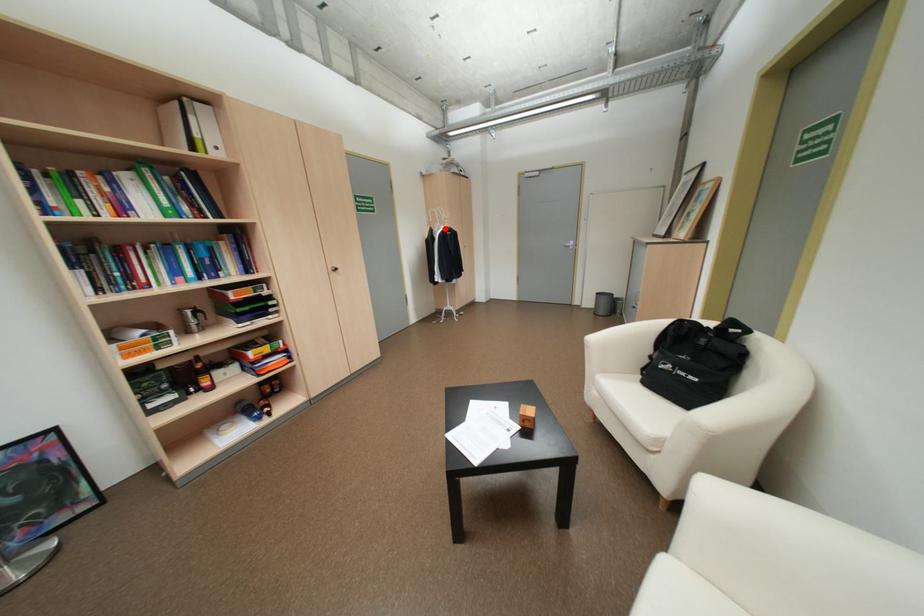
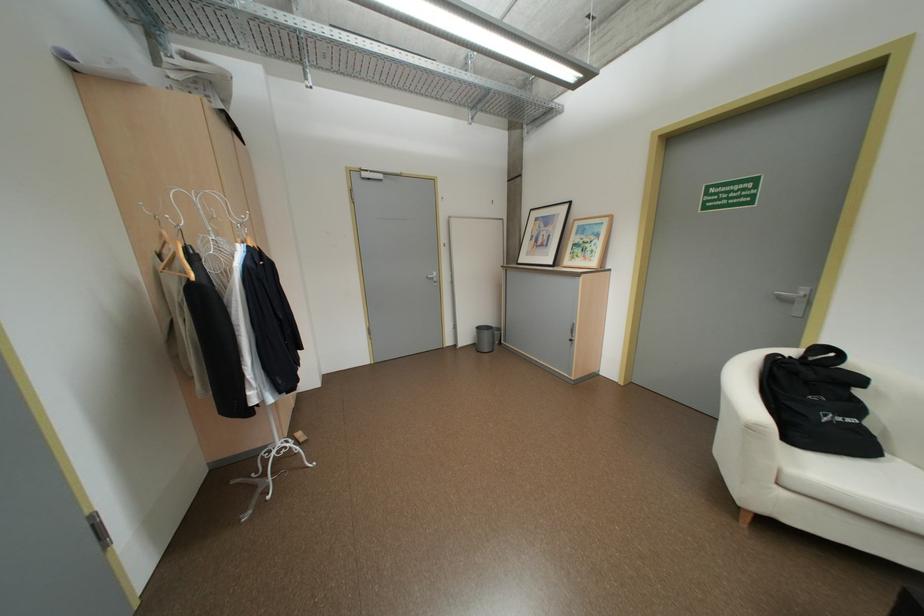
Question: I am providing you with two images of the same scene from different viewpoints. Image1 has a red point marked. In image2, the corresponding 3D location appears at what relative position? Reply with the corresponding letter.

Choices:
 (A) Closer
 (B) Farther

Answer: (B)